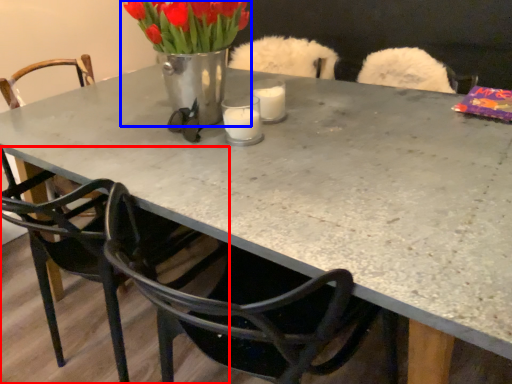
Question: Which object is closer to the camera taking this photo, chair (highlighted by a red box) or floral arrangement (highlighted by a blue box)?

Choices:
 (A) chair
 (B) floral arrangement

Answer: (A)